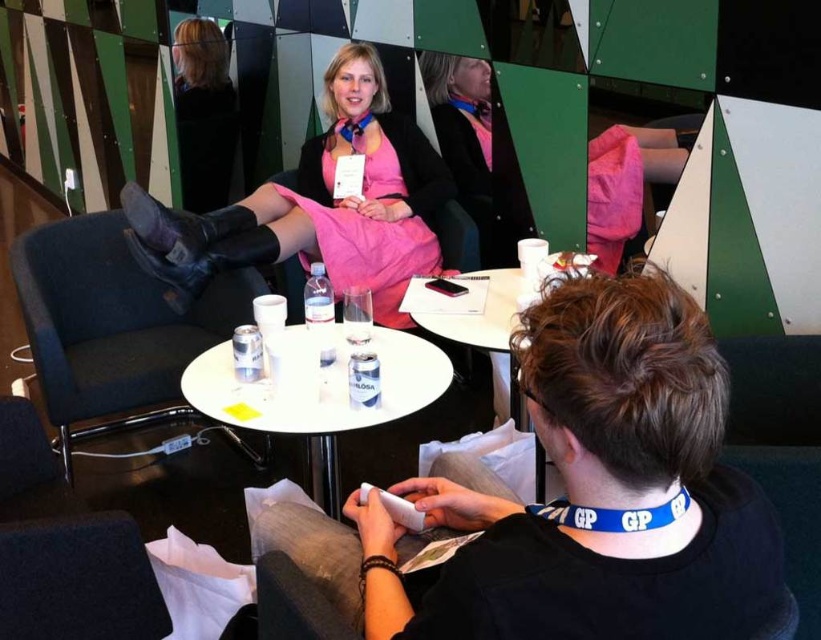
The image size is (821, 640). Describe the element at coordinates (579, 496) in the screenshot. I see `black matte phone at lower center` at that location.

How distant is black matte phone at lower center from white plastic table at center?

black matte phone at lower center and white plastic table at center are 21.41 inches apart.

Is point (594, 320) closer to camera compared to point (313, 401)?

Yes, it is in front of point (313, 401).

Identify the location of black matte phone at lower center. Image resolution: width=821 pixels, height=640 pixels. [x=579, y=496].

Which of these two, pink matte dress at center or white plastic table at center, stands taller?

pink matte dress at center

The height and width of the screenshot is (640, 821). I want to click on pink matte dress at center, so click(x=317, y=205).

Which of these two, black matte phone at lower center or pink matte dress at center, stands taller?

Standing taller between the two is pink matte dress at center.

How much distance is there between black matte phone at lower center and pink matte dress at center?

5.50 feet

What are the coordinates of `black matte phone at lower center` in the screenshot? It's located at (579, 496).